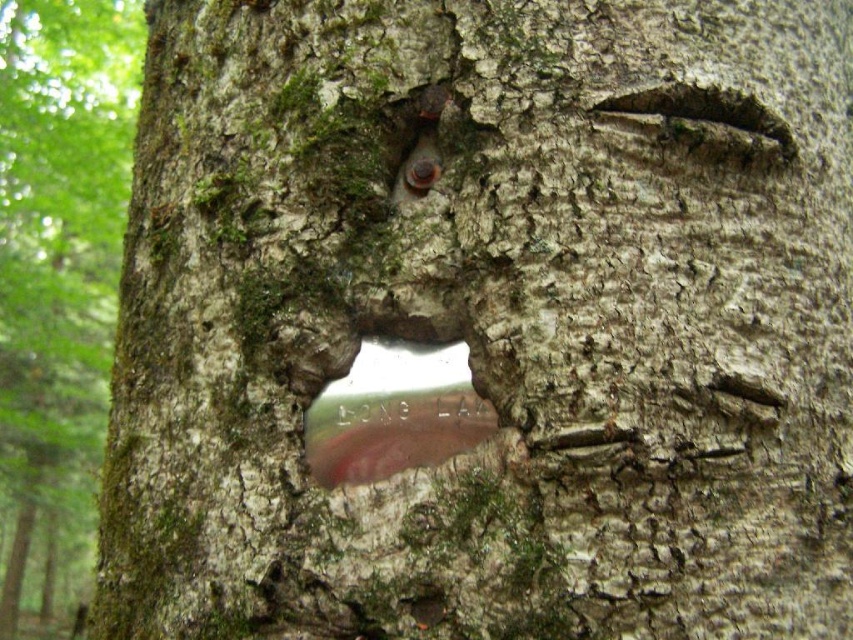
You are standing 2 meters away from the tree trunk. A point on the trunk at coordinates point (x=1, y=561) is visible. Can you reach this point with a 1.5 meter long stick?

The point (x=1, y=561) is 3.06 meters from the viewer. Since you are standing 2 meters away from the tree trunk, the total distance to the point is 5.06 meters. The 1.5 meter stick is too short to reach it.

You are standing 10 feet away from a tree trunk. You notice the green mossy bark at left. Can you reach it with a 10 foot long pole?

The green mossy bark at left is 9.76 feet away from the viewer, so yes, a 10 foot long pole would be sufficient to reach it.

You are an artist trying to paint this tree trunk scene. You want to focus on the green mossy bark at left and the transparent plastic hole at center. Which of these two objects should you paint first if you want to emphasize their size difference?

The green mossy bark at left should be painted first because it has a larger size compared to the transparent plastic hole at center, allowing you to establish the scale before detailing the smaller feature.